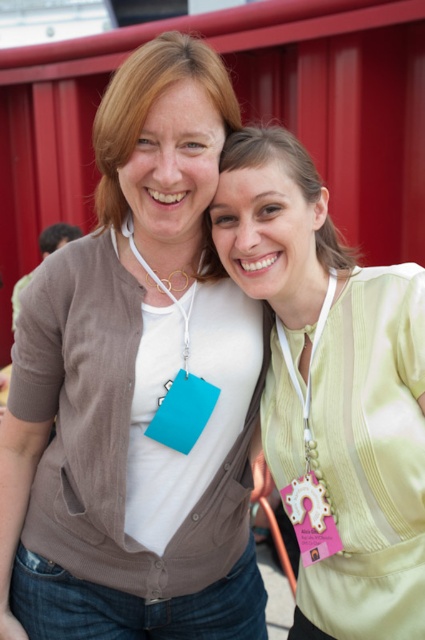
You are a photographer trying to capture a closeup of the pink fabric badge at right while ensuring the light green fabric at center is still visible in the frame. Given their size difference, which fabric should you focus on to ensure both are in the shot without cropping?

The light green fabric at center is larger in size than the pink fabric badge at right, so focusing on the light green fabric at center will ensure both are visible without cropping.

You are a photographer trying to capture a clear shot of the matte white shirt at center and the light green fabric at center. Which object is closer to the camera?

The matte white shirt at center is closer to the camera because it is in front of the light green fabric at center.